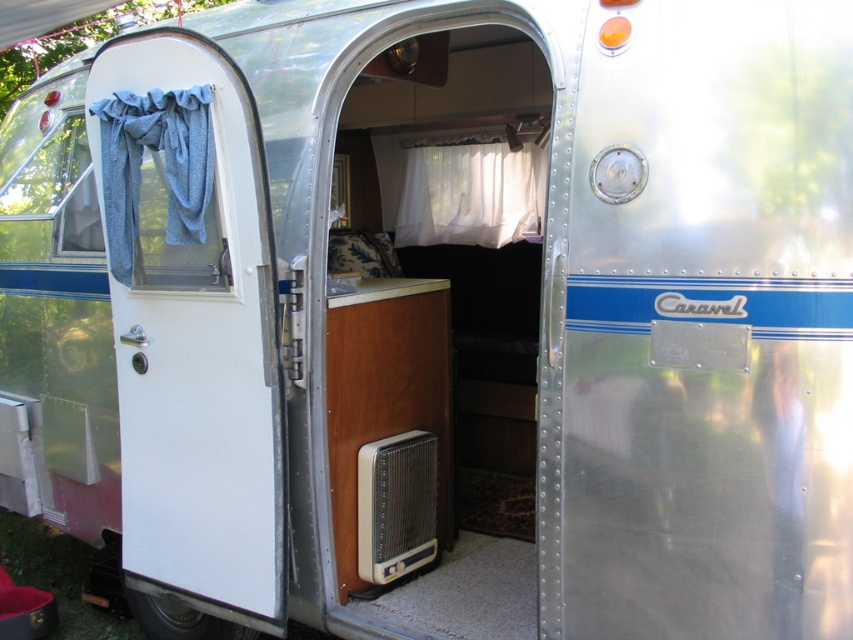
What do you see at coordinates (433, 305) in the screenshot? The image size is (853, 640). I see `white matte door at center` at bounding box center [433, 305].

Who is lower down, white matte door at center or white matte door at left?

white matte door at left

Locate an element on the screen. white matte door at center is located at coordinates (433, 305).

The width and height of the screenshot is (853, 640). In order to click on white matte door at center in this screenshot , I will do `click(433, 305)`.